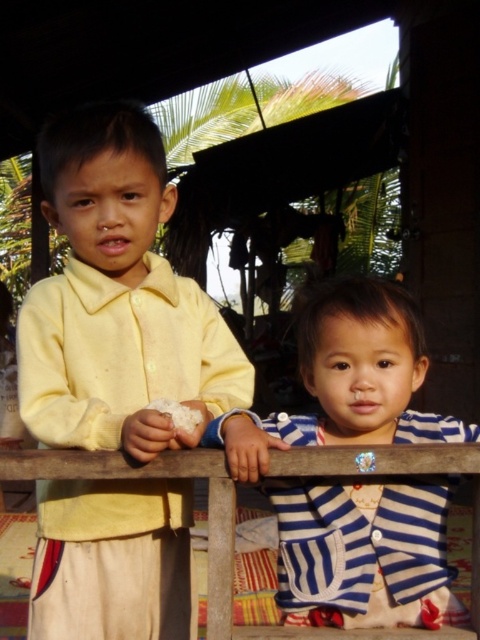
Question: Is yellow matte shirt at left closer to the viewer compared to blue striped shirt at center?

Choices:
 (A) no
 (B) yes

Answer: (A)

Question: Which of the following is the farthest from the observer?

Choices:
 (A) (339, 605)
 (B) (163, 564)
 (C) (175, 456)

Answer: (B)

Question: Among these points, which one is farthest from the camera?

Choices:
 (A) (225, 586)
 (B) (94, 250)

Answer: (B)

Question: Observing the image, what is the correct spatial positioning of blue striped shirt at center in reference to wooden at center?

Choices:
 (A) right
 (B) left

Answer: (A)

Question: Considering the relative positions of yellow matte shirt at left and blue striped shirt at center in the image provided, where is yellow matte shirt at left located with respect to blue striped shirt at center?

Choices:
 (A) right
 (B) left

Answer: (B)

Question: Which point is closer to the camera?

Choices:
 (A) (362, 451)
 (B) (122, 602)
 (C) (302, 362)

Answer: (A)